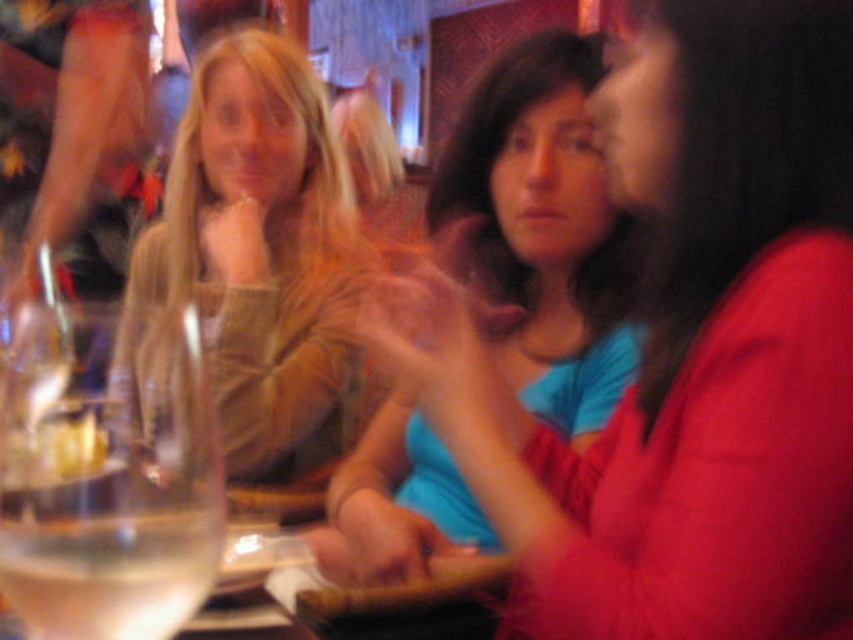
You are a photographer trying to capture a closeup of the clear glass wine glass at left without including the matte blue shirt at center in the frame. Based on their positions, which direction should you move your camera to the left or right?

The matte blue shirt at center is to the right of the clear glass wine glass at left, so moving the camera to the left would shift the frame away from the shirt and towards the glass, allowing you to capture the glass without the shirt in the shot.

You are a photographer trying to capture a candid shot of the matte blue shirt at center and the matte brown sweater at center. You need to ensure both subjects are in focus. The camera you are using has a depth of field that can cover 25 inches. Will both subjects be in focus?

The distance between the matte blue shirt at center and the matte brown sweater at center is 24.84 inches, which is just under the camera depth of field of 25 inches. Therefore, both subjects will be in focus.